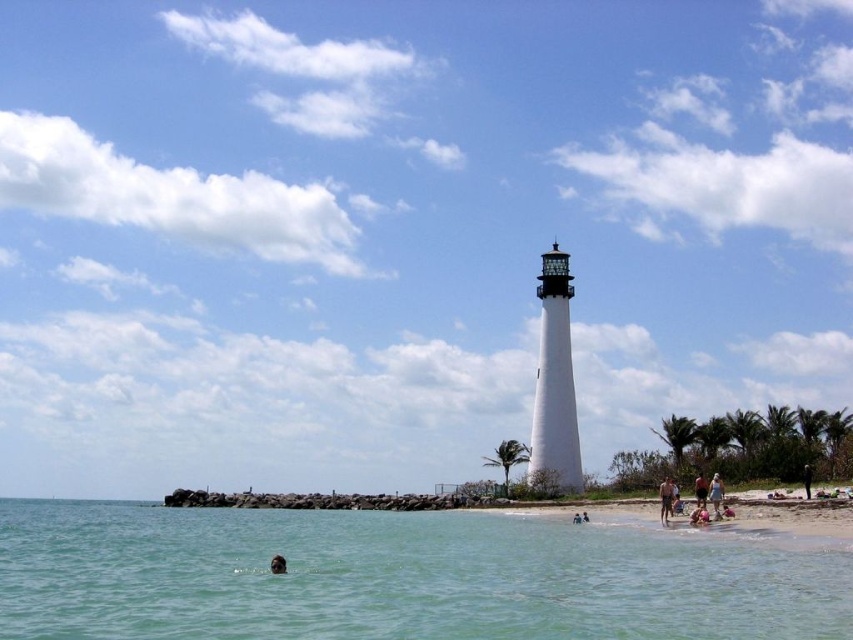
Question: Does sandy beach at lower right have a smaller size compared to tan skin person at lower right?

Choices:
 (A) yes
 (B) no

Answer: (B)

Question: Considering the real-world distances, which object is farthest from the tan skin person at lower right?

Choices:
 (A) black fabric person at lower right
 (B) white smooth lighthouse at center

Answer: (B)

Question: Which point is farther to the camera?

Choices:
 (A) (718, 499)
 (B) (111, 512)
 (C) (802, 470)

Answer: (B)

Question: Is clear blue water at lower left to the left of black fabric person at lower right from the viewer's perspective?

Choices:
 (A) yes
 (B) no

Answer: (A)

Question: Which point is closer to the camera taking this photo?

Choices:
 (A) (273, 557)
 (B) (558, 298)

Answer: (A)

Question: Is clear blue water at lower left to the left of white smooth lighthouse at center from the viewer's perspective?

Choices:
 (A) no
 (B) yes

Answer: (B)